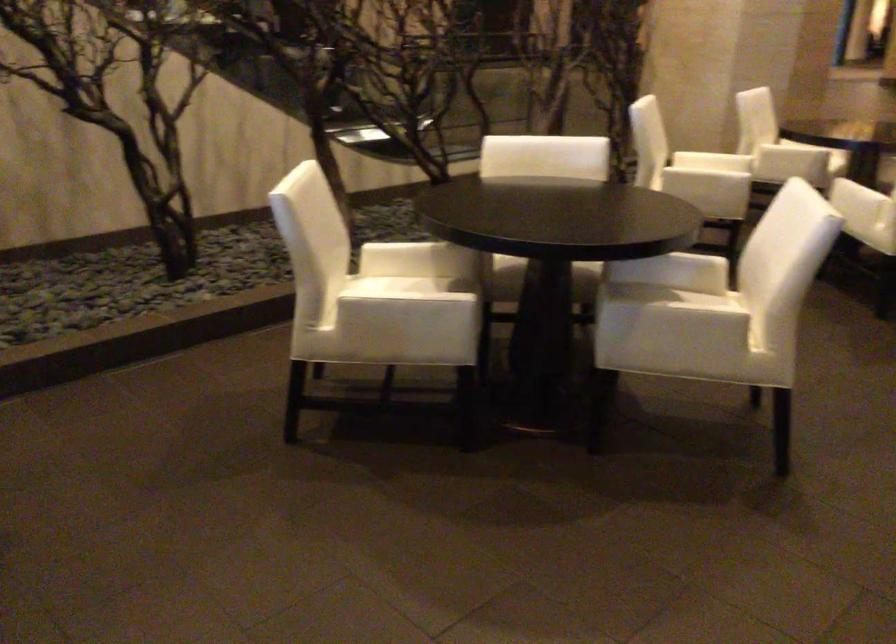
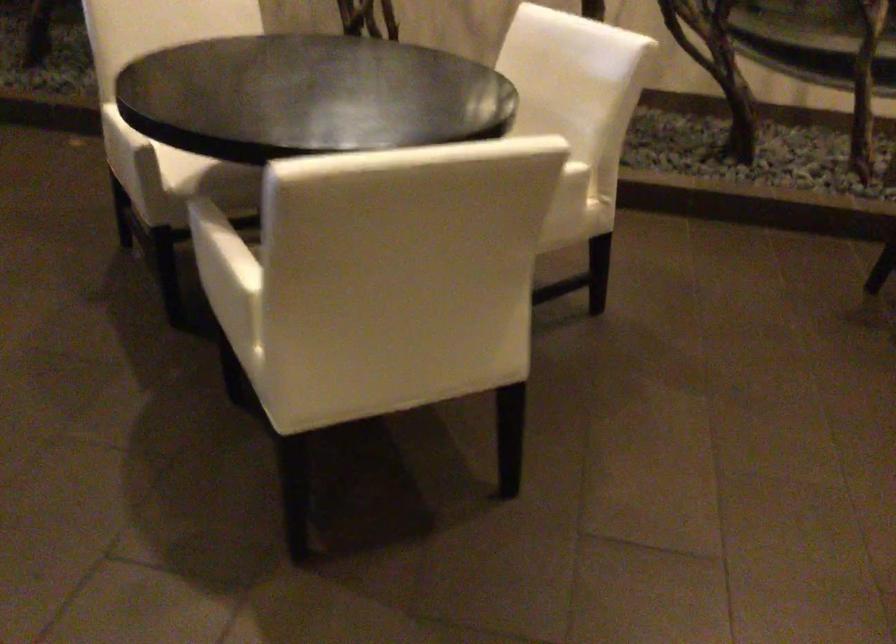
Find the pixel in the second image that matches pixel 424 310 in the first image.

(118, 138)